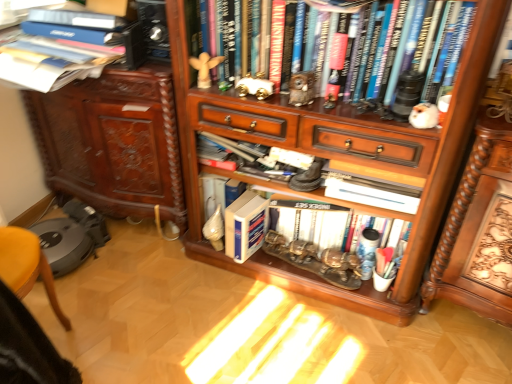
At what (x,y) coordinates should I click in order to perform the action: click on vacant area that is in front of wooden cabinet at left. Please return your answer as a coordinate pair (x, y). Image resolution: width=512 pixels, height=384 pixels. Looking at the image, I should click on (138, 288).